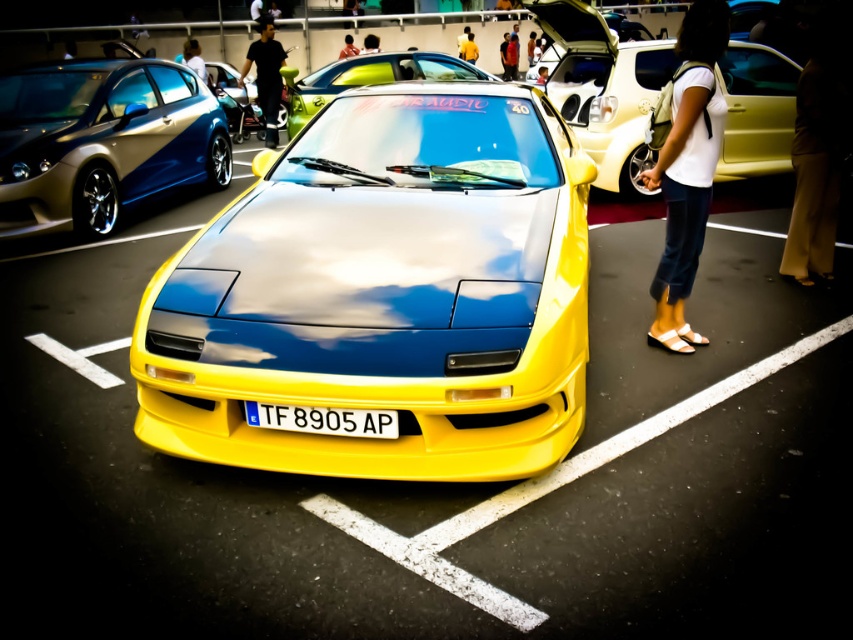
Question: Is yellow glossy sports car at center smaller than matte black shirt at center?

Choices:
 (A) yes
 (B) no

Answer: (B)

Question: Estimate the real-world distances between objects in this image. Which object is farther from the white cotton shirt at center?

Choices:
 (A) metallic gold hatchback at left
 (B) yellow glossy car at center
 (C) smooth skin face at center
 (D) black smooth shirt at upper center

Answer: (C)

Question: Which of the following is the farthest from the observer?

Choices:
 (A) (199, 65)
 (B) (483, 353)

Answer: (A)

Question: Which of the following is the farthest from the observer?

Choices:
 (A) (619, 186)
 (B) (363, 44)
 (C) (26, 198)

Answer: (B)

Question: Does yellow glossy sports car at center have a larger size compared to shiny metallic car at center?

Choices:
 (A) yes
 (B) no

Answer: (A)

Question: Is metallic gold hatchback at left closer to camera compared to black smooth shirt at upper center?

Choices:
 (A) yes
 (B) no

Answer: (A)